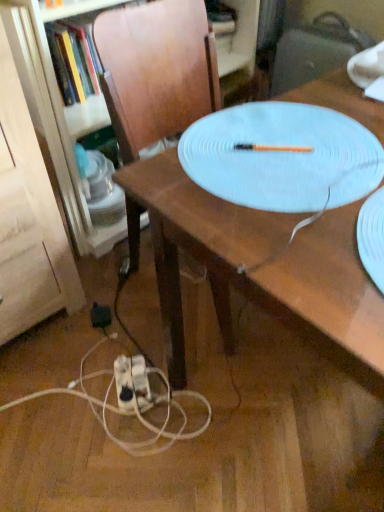
This screenshot has width=384, height=512. Find the location of `vacant area on the back side of white plastic extension cord at lower center`. vacant area on the back side of white plastic extension cord at lower center is located at coordinates (134, 336).